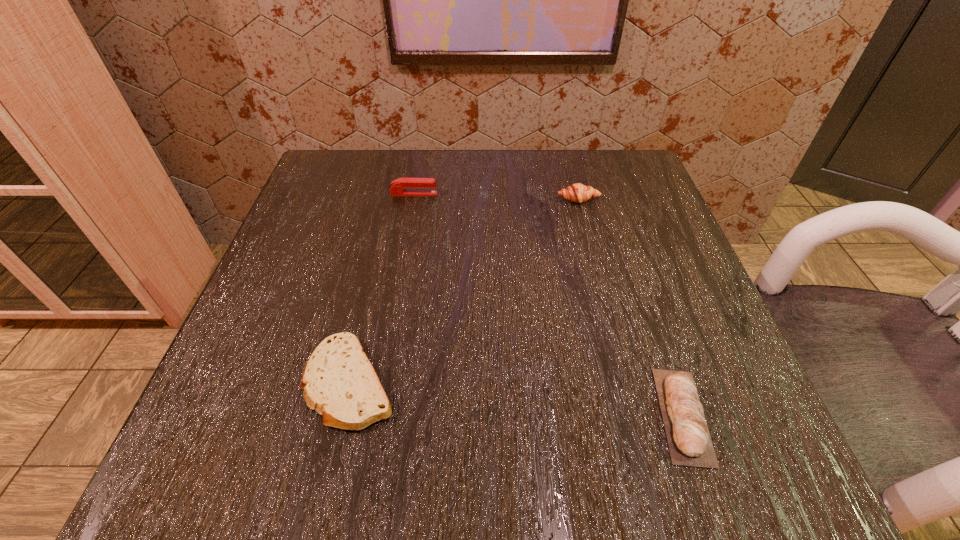
The image size is (960, 540). Find the location of `stapler`. stapler is located at coordinates (419, 186).

At what (x,y) coordinates should I click in order to perform the action: click on pastry. Please return your answer as a coordinate pair (x, y). Looking at the image, I should click on (579, 193).

This screenshot has width=960, height=540. I want to click on the right pita bread, so click(689, 441).

The image size is (960, 540). In order to click on the left pita bread in this screenshot , I will do `click(339, 382)`.

At what (x,y) coordinates should I click in order to perform the action: click on the shorter pita bread. Please return your answer as a coordinate pair (x, y). Image resolution: width=960 pixels, height=540 pixels. Looking at the image, I should click on (339, 382).

I want to click on vacant space located 0.070m on the front-facing side of the stapler, so click(x=470, y=194).

At what (x,y) coordinates should I click in order to perform the action: click on free region located 0.160m on the front-facing side of the pastry. Please return your answer as a coordinate pair (x, y). The width and height of the screenshot is (960, 540). Looking at the image, I should click on (593, 259).

The height and width of the screenshot is (540, 960). In order to click on vacant space situated on the left of the right pita bread in this screenshot , I will do `click(516, 415)`.

You are a GUI agent. You are given a task and a screenshot of the screen. Output one action in this format:
    pyautogui.click(x=<x>, y=<y>)
    Task: Click on the blank area located on the back of the shortest object
    
    Given the screenshot: What is the action you would take?
    pyautogui.click(x=379, y=258)

Identify the location of stapler located in the far edge section of the desktop. (419, 186).